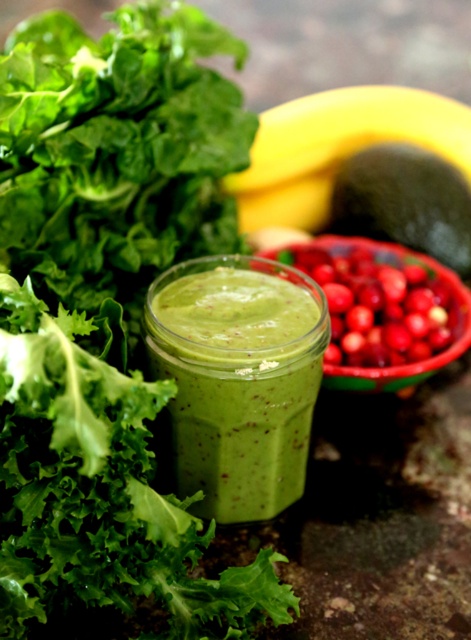
This screenshot has height=640, width=471. What do you see at coordinates (376, 305) in the screenshot?
I see `shiny red berries at center` at bounding box center [376, 305].

Image resolution: width=471 pixels, height=640 pixels. In order to click on shiny red berries at center in this screenshot , I will do `click(376, 305)`.

Which is more to the right, yellow matte banana at upper center or shiny red berries at center?

Positioned to the right is yellow matte banana at upper center.

Between yellow matte banana at upper center and shiny red berries at center, which one has less height?

Standing shorter between the two is shiny red berries at center.

Locate an element on the screen. The image size is (471, 640). yellow matte banana at upper center is located at coordinates (365, 168).

From the picture: Does green matte smoothie at center appear on the left side of yellow matte banana at upper center?

Yes, green matte smoothie at center is to the left of yellow matte banana at upper center.

How distant is green matte smoothie at center from yellow matte banana at upper center?

A distance of 9.06 inches exists between green matte smoothie at center and yellow matte banana at upper center.

Describe the element at coordinates (238, 378) in the screenshot. This screenshot has width=471, height=640. I see `green matte smoothie at center` at that location.

Where is `green matte smoothie at center`? The height and width of the screenshot is (640, 471). green matte smoothie at center is located at coordinates (238, 378).